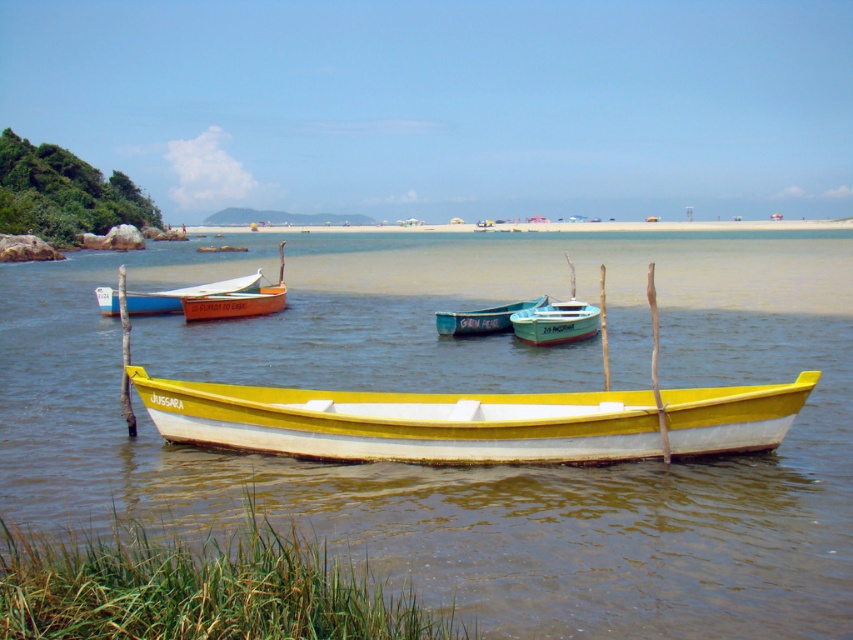
Question: In this image, where is orange wood canoe at center located relative to teal glossy canoe at center?

Choices:
 (A) below
 (B) above

Answer: (B)

Question: Is yellow matte boat at center to the right of teal glossy canoe at center from the viewer's perspective?

Choices:
 (A) no
 (B) yes

Answer: (A)

Question: Does yellow matte boat at center appear on the right side of orange wood canoe at center?

Choices:
 (A) no
 (B) yes

Answer: (B)

Question: Among these objects, which one is farthest from the camera?

Choices:
 (A) orange wood canoe at center
 (B) yellow matte water at center
 (C) teal matte boat at center
 (D) yellow matte boat at center

Answer: (A)

Question: Which of the following is the farthest from the observer?

Choices:
 (A) (192, 321)
 (B) (734, 624)
 (C) (169, 289)

Answer: (C)

Question: Which point is closer to the camera?

Choices:
 (A) matte white canoe at center
 (B) teal matte boat at center
 (C) yellow matte water at center
 (D) teal glossy canoe at center

Answer: (C)